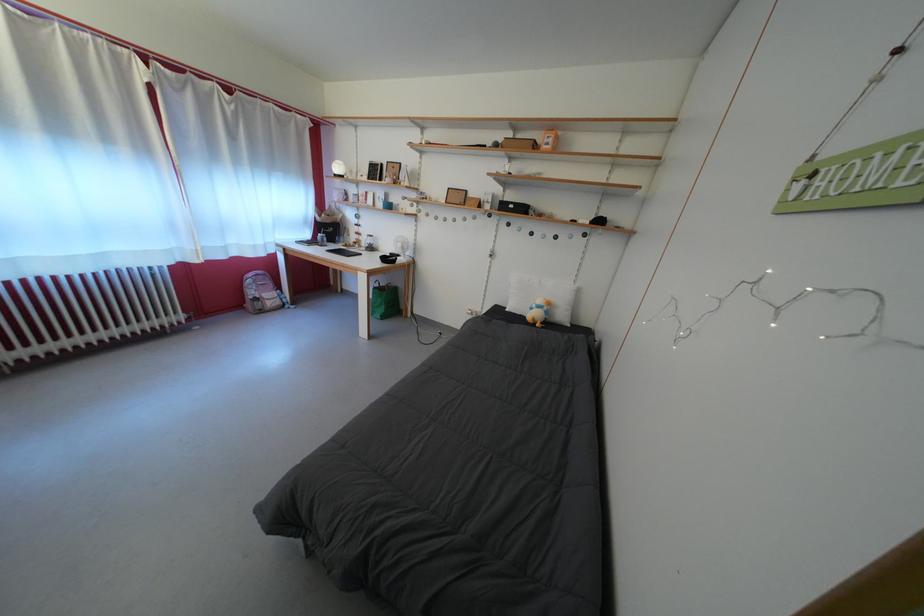
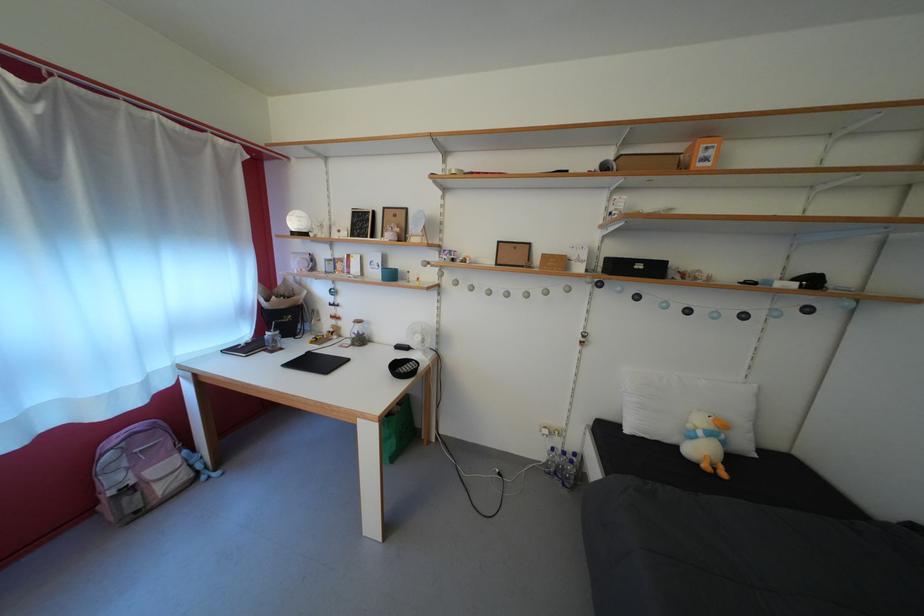
Locate, in the second image, the point that corresponds to [261,299] in the first image.

(123, 485)